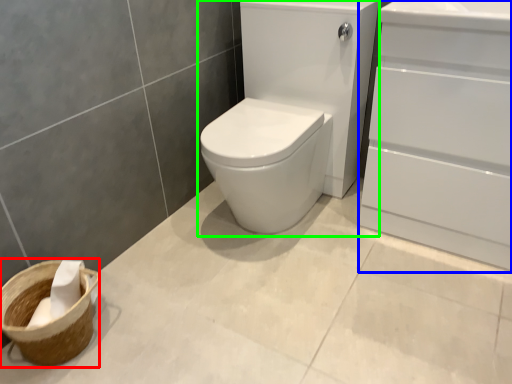
Question: Which object is positioned closest to basket container (highlighted by a red box)? Select from screen door (highlighted by a blue box) and sink (highlighted by a green box).

Choices:
 (A) screen door
 (B) sink

Answer: (B)